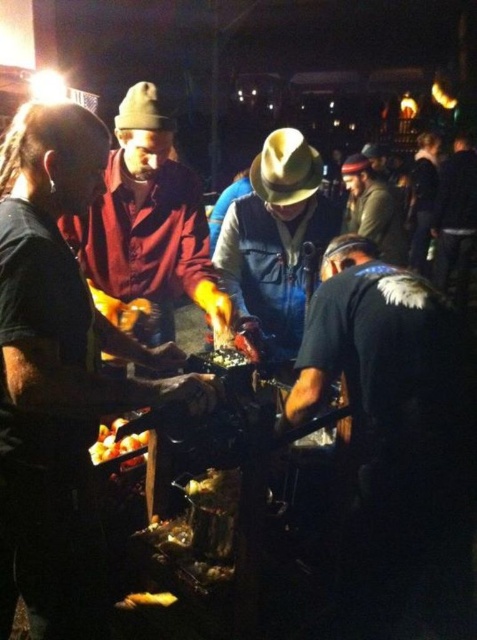
Question: Which object appears closest to the camera in this image?

Choices:
 (A) golden crispy fries at center
 (B) brown felt cowboy hat at upper center
 (C) green felt hat at upper right
 (D) denim vest at center

Answer: (A)

Question: Does black leather jacket at lower right appear under golden crispy bread at lower center?

Choices:
 (A) no
 (B) yes

Answer: (A)

Question: Can you confirm if black leather jacket at lower right is smaller than brown felt cowboy hat at upper center?

Choices:
 (A) yes
 (B) no

Answer: (B)

Question: In this image, where is black leather jacket at lower right located relative to golden crispy fries at center?

Choices:
 (A) below
 (B) above

Answer: (B)

Question: Which point appears farthest from the camera in this image?

Choices:
 (A) (383, 372)
 (B) (165, 116)

Answer: (B)

Question: Which point is closer to the camera?

Choices:
 (A) golden crispy fries at center
 (B) tan felt cowboy hat at center
 (C) denim vest at center

Answer: (A)